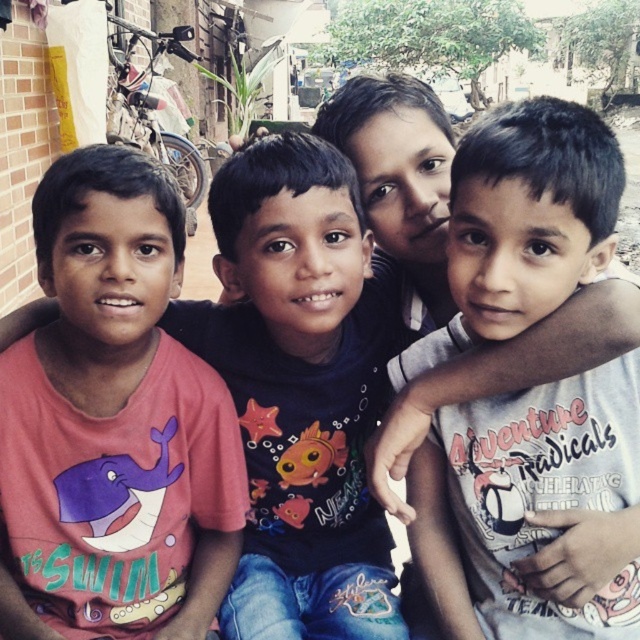
Who is shorter, white matte shirt at center or pink matte t-shirt at left?

pink matte t-shirt at left

How much distance is there between white matte shirt at center and pink matte t-shirt at left?

25.30 inches

Does point (621, 584) lie behind point (109, 362)?

No, (621, 584) is in front of (109, 362).

This screenshot has height=640, width=640. I want to click on white matte shirt at center, so click(525, 500).